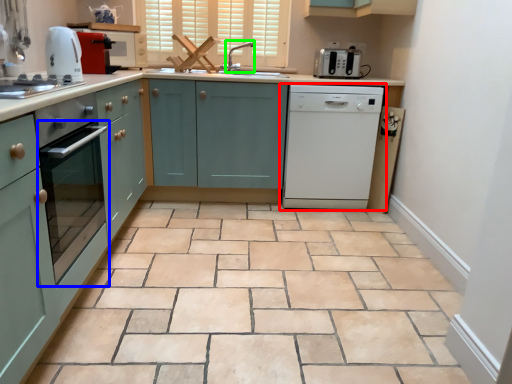
Question: Based on their relative distances, which object is farther from home appliance (highlighted by a red box)? Choose from oven (highlighted by a blue box) and faucet (highlighted by a green box).

Choices:
 (A) oven
 (B) faucet

Answer: (A)